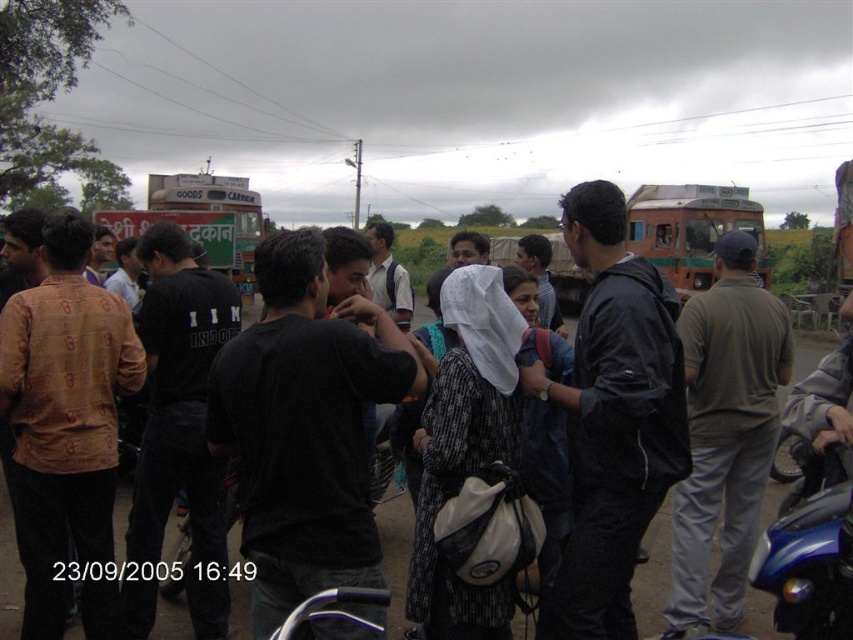
You are a delivery person who needs to load a large package onto a vehicle. You see the green painted bus at center and the green painted goods carrier at upper left. Which vehicle is more suitable for carrying heavy items?

The green painted goods carrier at upper left is more suitable for carrying heavy items because it is larger in size compared to the green painted bus at center.

You are a photographer trying to capture a photo of the green painted bus at center without including the light brown cotton shirt at center in the frame. Given their sizes, which object should you focus on to ensure the bus is the main subject and the shirt is out of view?

The light brown cotton shirt at center is larger in size than the green painted bus at center. To ensure the bus is the main subject and the shirt is out of view, focus on the green painted bus at center and adjust the camera angle to exclude the larger light brown cotton shirt at center from the frame.